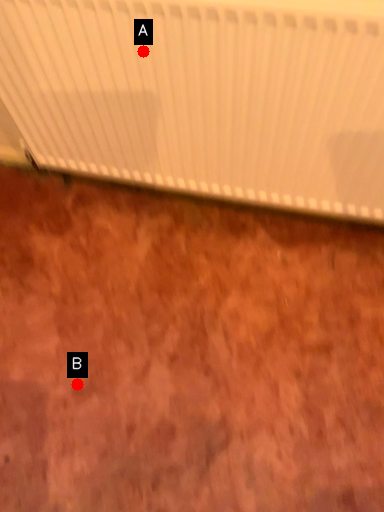
Question: Two points are circled on the image, labeled by A and B beside each circle. Which of the following is the closest to the observer?

Choices:
 (A) A is closer
 (B) B is closer

Answer: (A)